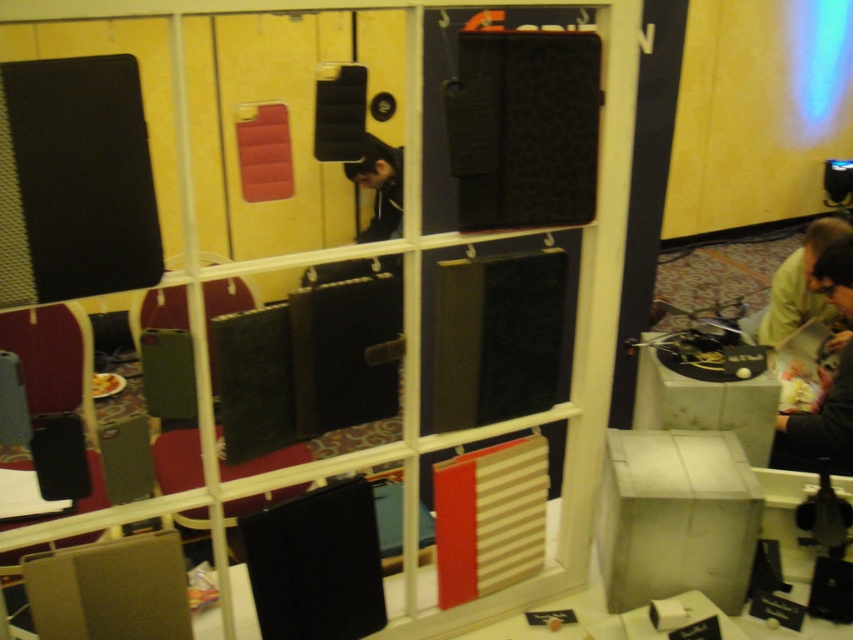
You are at a trade show and need to place a small promotional item on the light beige fabric at lower right. According to the coordinates provided, where exactly should you place it?

The light beige fabric at lower right is located at point (819, 426), so you should place the item there.

You are a delivery person who needs to place a small package between the light beige fabric at lower right and the yellow matte shirt at lower right. Can you fit it there?

The light beige fabric at lower right and the yellow matte shirt at lower right are 11.37 inches apart from each other. Since the package is small, it can fit in the space between them.

Consider the image. You are at the trade show and need to locate two points marked on the glass partition. The first point is at coordinate point(817, 230) and the second is at point(389, 189). Which point is closer to you when standing in front of the glass partition?

Point(817, 230) is in front of point(389, 189), so it is closer to you when standing in front of the glass partition.